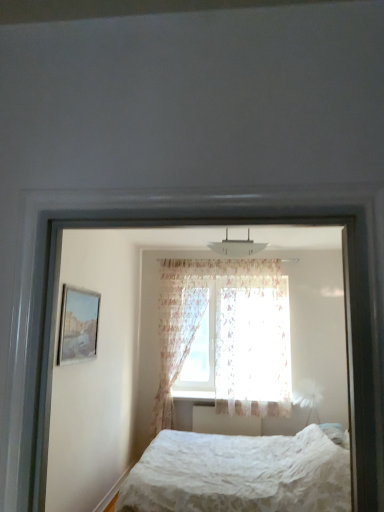
Question: Can you confirm if white textured bed at center, which is the 1th bed from front to back, is wider than matte glass picture frame at left?

Choices:
 (A) yes
 (B) no

Answer: (A)

Question: Considering the relative sizes of white textured bed at center, acting as the second bed starting from the bottom, and matte glass picture frame at left in the image provided, is white textured bed at center, acting as the second bed starting from the bottom, shorter than matte glass picture frame at left?

Choices:
 (A) yes
 (B) no

Answer: (B)

Question: Does white textured bed at center, which is the 1th bed from front to back, appear on the right side of matte glass picture frame at left?

Choices:
 (A) yes
 (B) no

Answer: (A)

Question: Is white textured bed at center, which is the 1th bed from top to bottom, completely or partially outside of matte glass picture frame at left?

Choices:
 (A) yes
 (B) no

Answer: (A)

Question: Is white textured bed at center, acting as the second bed starting from the bottom, behind matte glass picture frame at left?

Choices:
 (A) yes
 (B) no

Answer: (B)

Question: Is there a large distance between white textured bed at center, acting as the second bed starting from the bottom, and matte glass picture frame at left?

Choices:
 (A) no
 (B) yes

Answer: (B)

Question: Is white textured bed at center, which is the 1th bed from top to bottom, oriented away from floral fabric curtain at center, arranged as the 2th curtain when viewed from the right?

Choices:
 (A) no
 (B) yes

Answer: (B)

Question: Does white textured bed at center, which is the 1th bed from top to bottom, come behind floral fabric curtain at center, arranged as the 2th curtain when viewed from the right?

Choices:
 (A) no
 (B) yes

Answer: (A)

Question: Would you consider white textured bed at center, marked as the 2th bed in a back-to-front arrangement, to be distant from floral fabric curtain at center, the first curtain when ordered from left to right?

Choices:
 (A) no
 (B) yes

Answer: (B)

Question: Is white textured bed at center, acting as the second bed starting from the bottom, aimed at floral fabric curtain at center, arranged as the 2th curtain when viewed from the right?

Choices:
 (A) no
 (B) yes

Answer: (A)

Question: Is white textured bed at center, which is the 1th bed from front to back, not within floral fabric curtain at center, arranged as the 2th curtain when viewed from the right?

Choices:
 (A) no
 (B) yes

Answer: (B)

Question: Is white textured bed at center, which is the 1th bed from top to bottom, bigger than floral fabric curtain at center, the first curtain when ordered from left to right?

Choices:
 (A) no
 (B) yes

Answer: (A)

Question: Does white textured bed at center, which is the 1th bed from top to bottom, have a lesser width compared to white lace bed at lower center, the second bed in the top-to-bottom sequence?

Choices:
 (A) yes
 (B) no

Answer: (A)